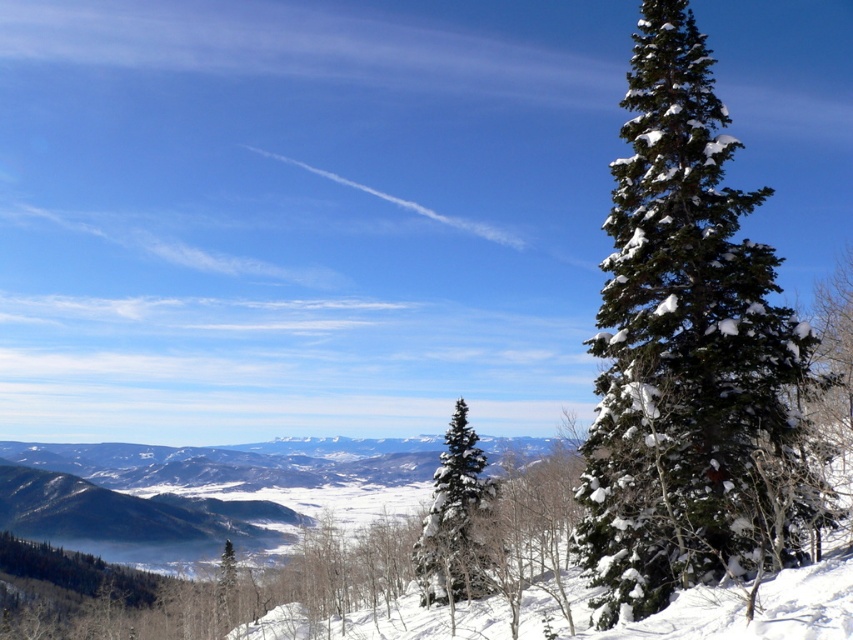
Question: Does green needle-like tree at center appear over snow-covered evergreen at center?

Choices:
 (A) no
 (B) yes

Answer: (B)

Question: Among these points, which one is farthest from the camera?

Choices:
 (A) (473, 444)
 (B) (635, 570)

Answer: (A)

Question: Does green needle-like tree at center appear over snow-covered evergreen at center?

Choices:
 (A) no
 (B) yes

Answer: (B)

Question: Considering the relative positions of green needle-like tree at center and snow-covered evergreen at center in the image provided, where is green needle-like tree at center located with respect to snow-covered evergreen at center?

Choices:
 (A) above
 (B) below

Answer: (A)

Question: Which point is closer to the camera taking this photo?

Choices:
 (A) (741, 212)
 (B) (460, 413)

Answer: (A)